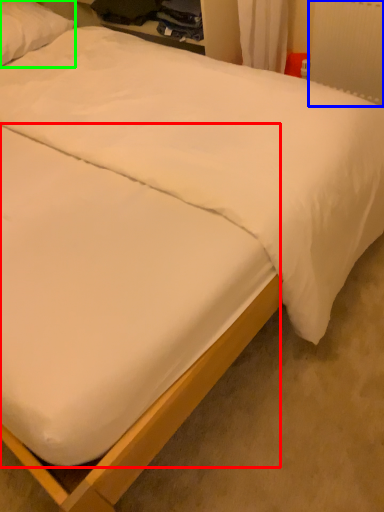
Question: Which is farther away from mattress (highlighted by a red box)? radiator (highlighted by a blue box) or pillow (highlighted by a green box)?

Choices:
 (A) radiator
 (B) pillow

Answer: (B)